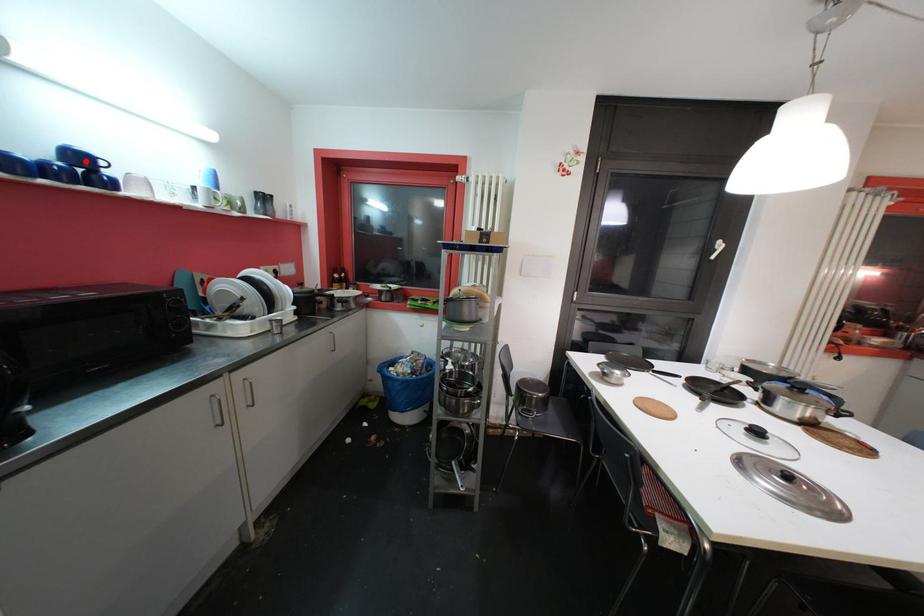
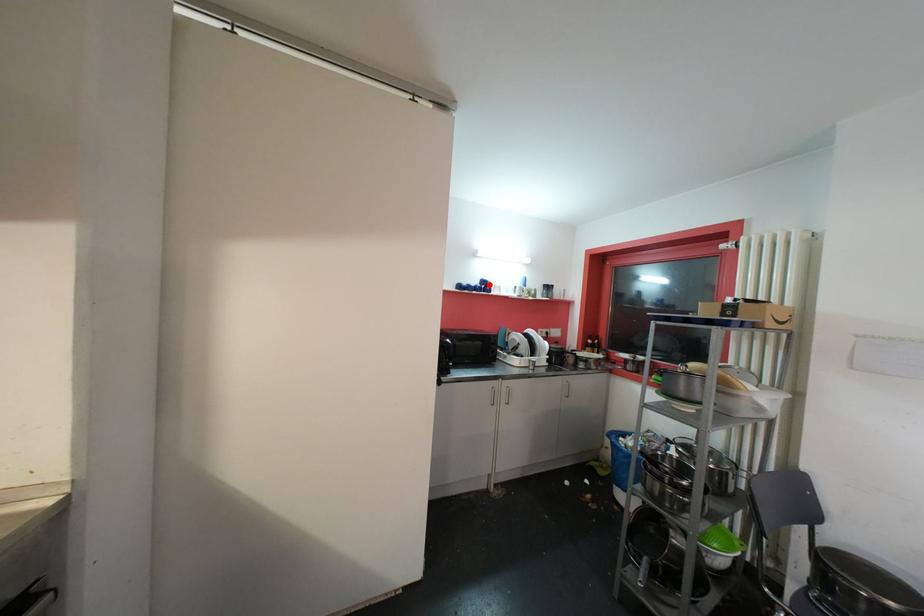
I am providing you with two images of the same scene from different viewpoints. A red point is marked on the first image and another point is marked on the second image. Is the marked point in image1 the same physical position as the marked point in image2?

Yes